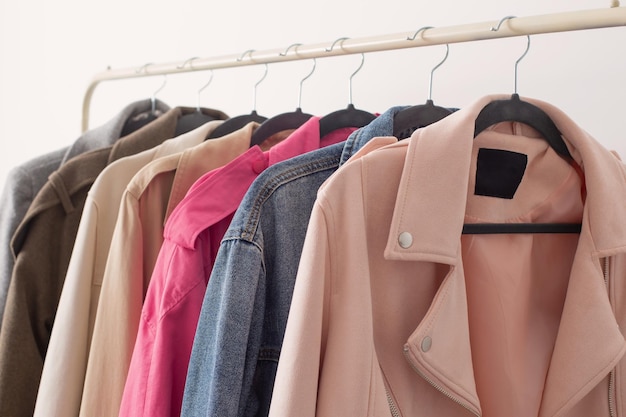
Find the location of a particular element. The width and height of the screenshot is (626, 417). hangers is located at coordinates (521, 114), (423, 123), (342, 115), (290, 124), (245, 118), (200, 112), (146, 107).